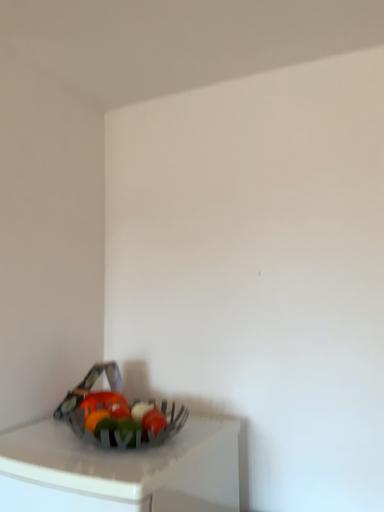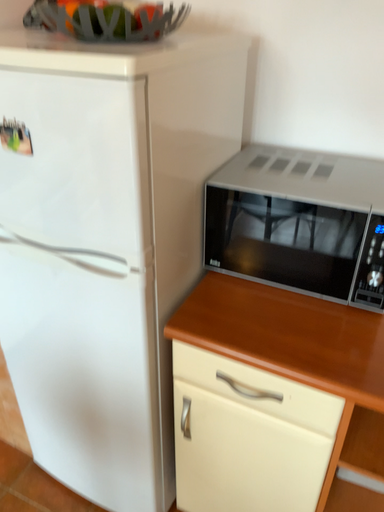
Question: Which way did the camera rotate in the video?

Choices:
 (A) rotated upward
 (B) rotated downward

Answer: (B)